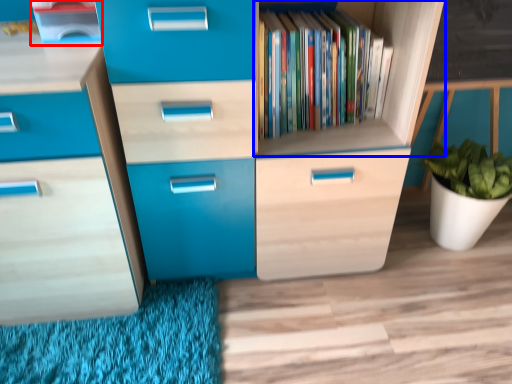
Question: Which object appears farthest to the camera in this image, cabinetry (highlighted by a red box) or shelf (highlighted by a blue box)?

Choices:
 (A) cabinetry
 (B) shelf

Answer: (B)